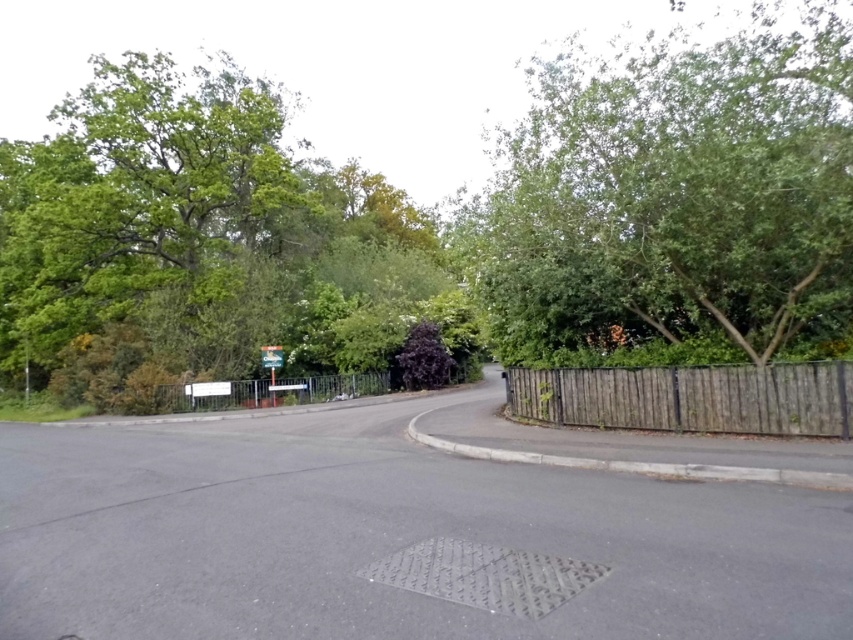
Does green leafy tree at upper left have a greater height compared to blue plastic sign at center?

Yes.

Does green leafy tree at upper left appear on the left side of blue plastic sign at center?

Correct, you'll find green leafy tree at upper left to the left of blue plastic sign at center.

Find the location of `green leafy tree at upper left`. green leafy tree at upper left is located at coordinates (202, 244).

Image resolution: width=853 pixels, height=640 pixels. Identify the location of green leafy tree at upper left. (202, 244).

Where is `green leafy tree at upper left`? The height and width of the screenshot is (640, 853). green leafy tree at upper left is located at coordinates point(202,244).

Does green leafy tree at upper left have a greater width compared to green leafy tree at upper right?

Correct, the width of green leafy tree at upper left exceeds that of green leafy tree at upper right.

Is point (108, 205) behind point (567, 262)?

Yes, it is behind point (567, 262).

At what (x,y) coordinates should I click in order to perform the action: click on green leafy tree at upper left. Please return your answer as a coordinate pair (x, y). Looking at the image, I should click on (202, 244).

Does green leafy tree at upper left lie in front of metallic silver fence at center?

Yes.

The image size is (853, 640). What do you see at coordinates (202, 244) in the screenshot?
I see `green leafy tree at upper left` at bounding box center [202, 244].

You are a GUI agent. You are given a task and a screenshot of the screen. Output one action in this format:
    pyautogui.click(x=<x>, y=<y>)
    Task: Click on the green leafy tree at upper left
    The width and height of the screenshot is (853, 640).
    Given the screenshot: What is the action you would take?
    202,244